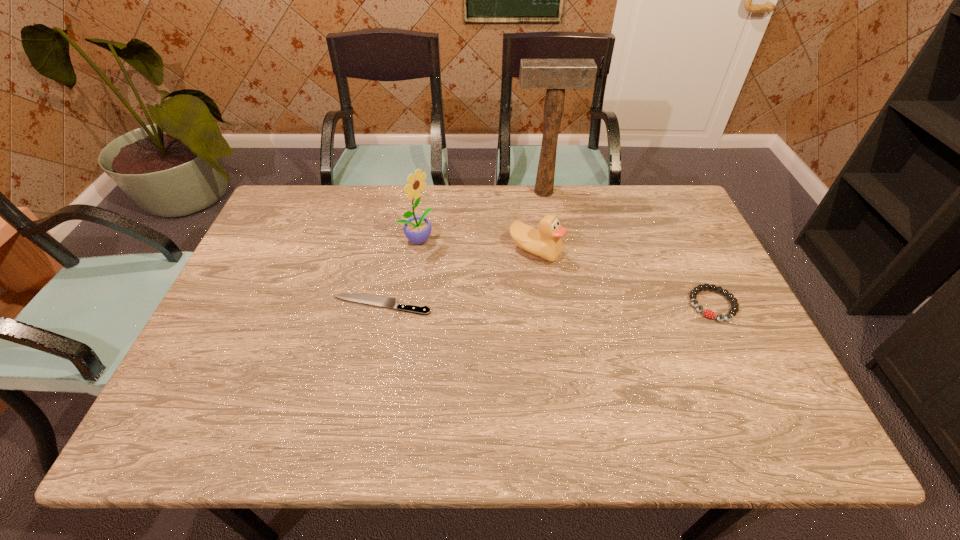
The image size is (960, 540). What are the coordinates of `free location that satisfies the following two spatial constraints: 1. on the front side of the tallest object; 2. on the right side of the fourth tallest object` in the screenshot? It's located at (563, 305).

I want to click on free location that satisfies the following two spatial constraints: 1. on the back side of the farthest object; 2. on the right side of the steak knife, so click(404, 192).